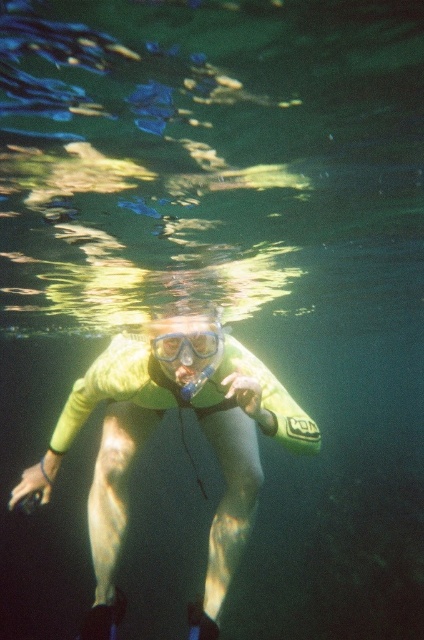
Is point (272, 417) farther from camera compared to point (201, 356)?

That is False.

Is yellow neoprene wetsuit at center thinner than clear plastic goggles at center?

In fact, yellow neoprene wetsuit at center might be wider than clear plastic goggles at center.

The height and width of the screenshot is (640, 424). What do you see at coordinates (153, 429) in the screenshot?
I see `yellow neoprene wetsuit at center` at bounding box center [153, 429].

The height and width of the screenshot is (640, 424). Find the location of `yellow neoprene wetsuit at center`. yellow neoprene wetsuit at center is located at coordinates (153, 429).